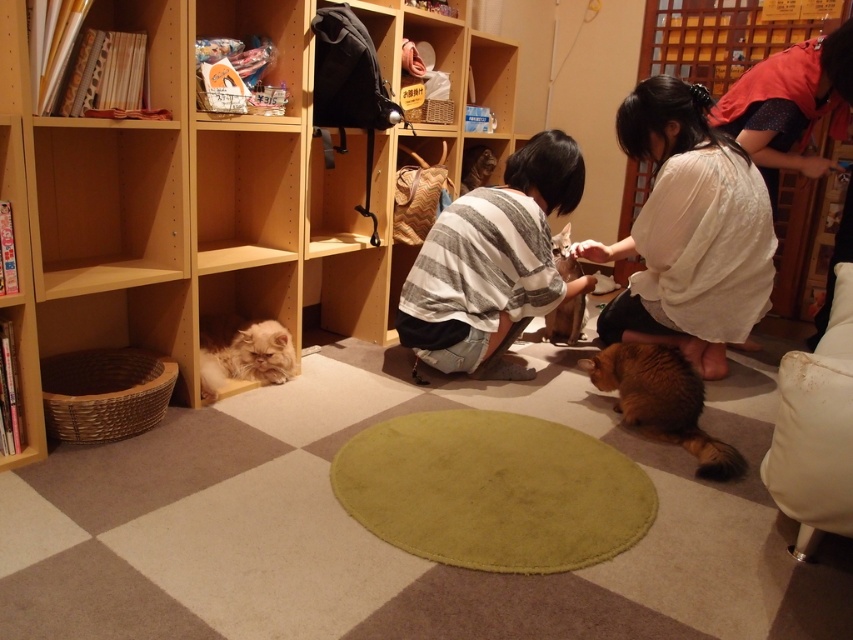
Does striped cotton shirt at center come in front of golden fur cat at lower right?

That is False.

Find the location of a particular element. The image size is (853, 640). striped cotton shirt at center is located at coordinates (492, 264).

Where is `striped cotton shirt at center`? This screenshot has height=640, width=853. striped cotton shirt at center is located at coordinates (492, 264).

Who is taller, white sheer blouse at center or fluffy white cat at lower left?

white sheer blouse at center

Which is above, white sheer blouse at center or fluffy white cat at lower left?

white sheer blouse at center is above.

Describe the element at coordinates (688, 230) in the screenshot. The width and height of the screenshot is (853, 640). I see `white sheer blouse at center` at that location.

Where is `white sheer blouse at center`? The width and height of the screenshot is (853, 640). white sheer blouse at center is located at coordinates (688, 230).

Which is above, golden fur cat at lower right or brown fluffy cat at center?

brown fluffy cat at center is higher up.

Between point (614, 380) and point (567, 243), which one is positioned in front?

Point (614, 380) is more forward.

I want to click on golden fur cat at lower right, so click(x=662, y=401).